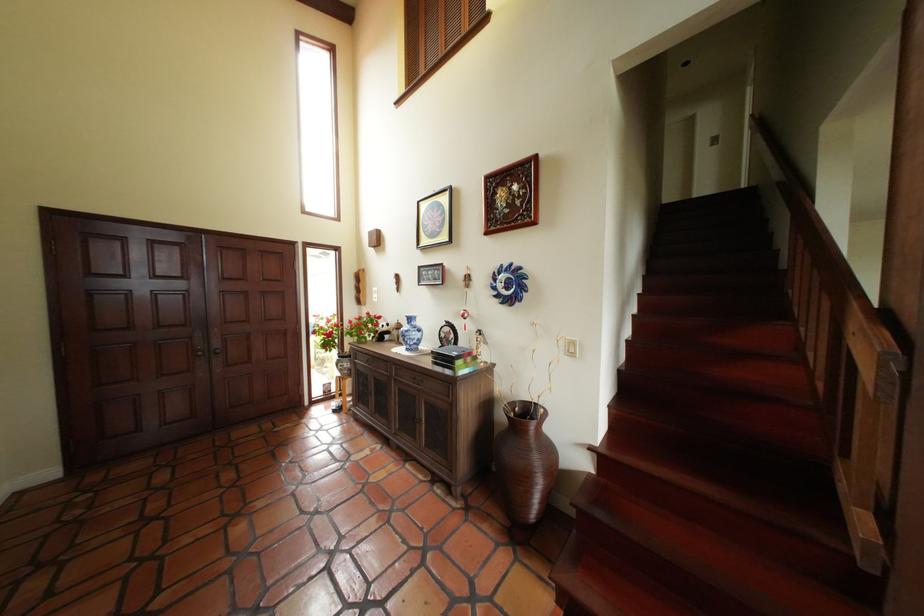
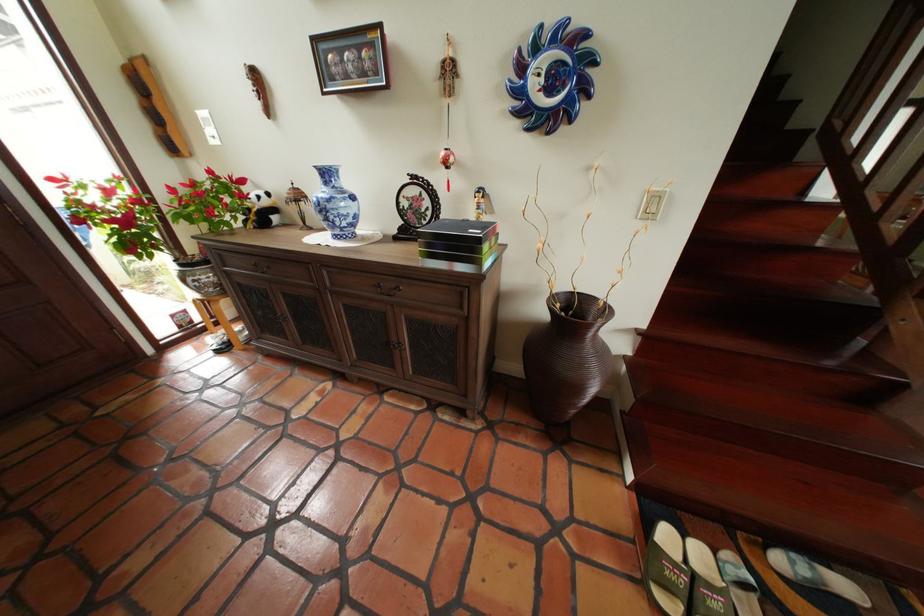
The point at [464,346] is marked in the first image. Where is the corresponding point in the second image?

(438, 221)